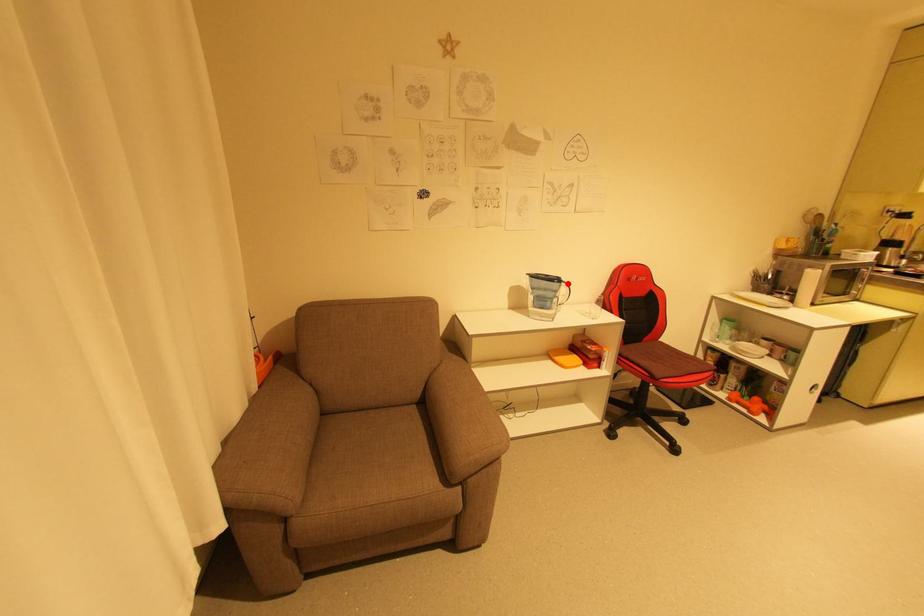
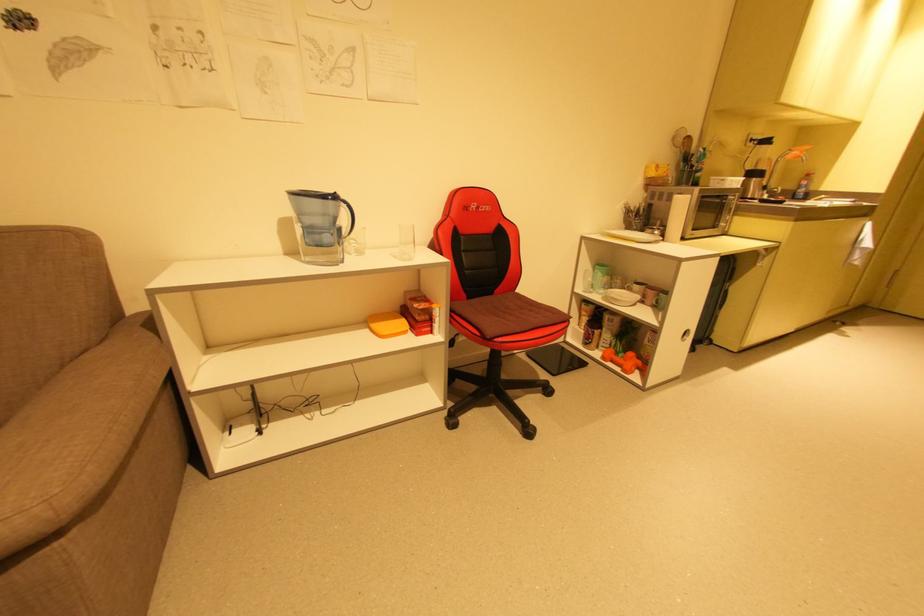
In the second image, find the point that corresponds to the highlighted location in the first image.

(346, 204)